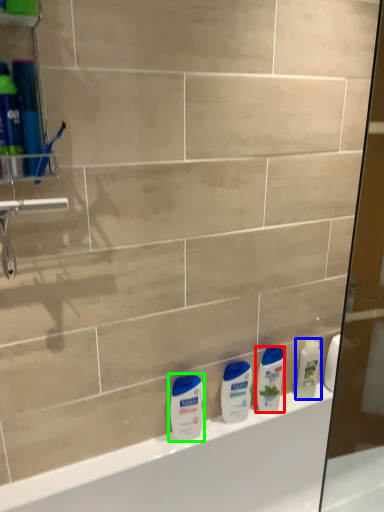
Question: Based on their relative distances, which object is farther from cleaning product (highlighted by a red box)? Choose from cleaning product (highlighted by a blue box) and toiletry (highlighted by a green box).

Choices:
 (A) cleaning product
 (B) toiletry

Answer: (B)